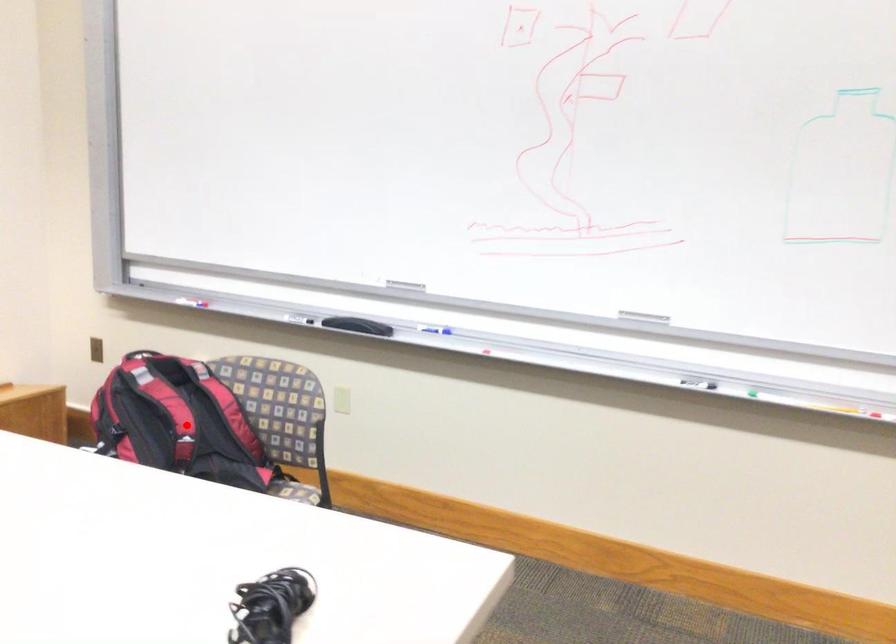
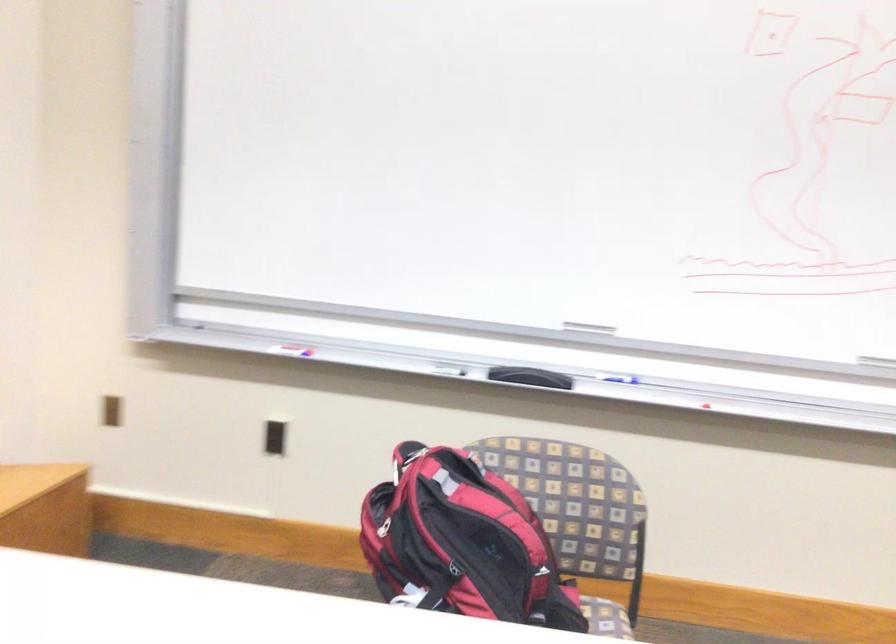
Question: I am providing you with two images of the same scene from different viewpoints. In image1, a red point is highlighted. Considering the same 3D point in image2, which of the following is correct?

Choices:
 (A) It is closer
 (B) It is farther

Answer: (A)